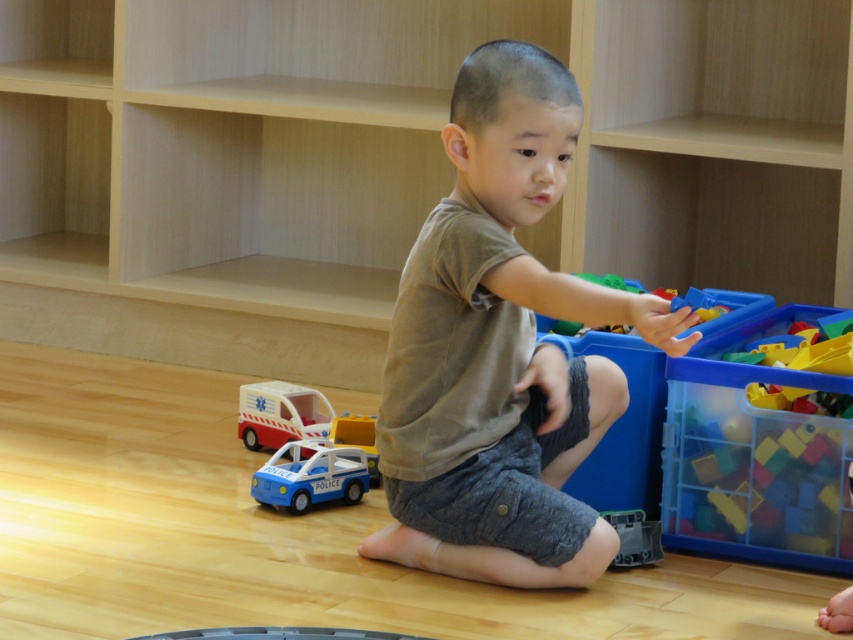
Please describe the position of the translucent plastic blocks at right relative to the child in the image.

The translucent plastic blocks at right are located at the lower right position in the image, which is to the right side of the child.

You are a photographer trying to capture the child in the image. The child is sitting on the wooden floor and wearing a light brown t shirt. There is a point at coordinates (500, 349) where a brown cotton shirt is located. If you want to place a toy ambulance to the left of the child, where should you position it relative to the brown cotton shirt at center?

The toy ambulance should be placed to the left of the brown cotton shirt at center since the child is sitting at the center with the shirt, and the ambulance is already to the left of the child.